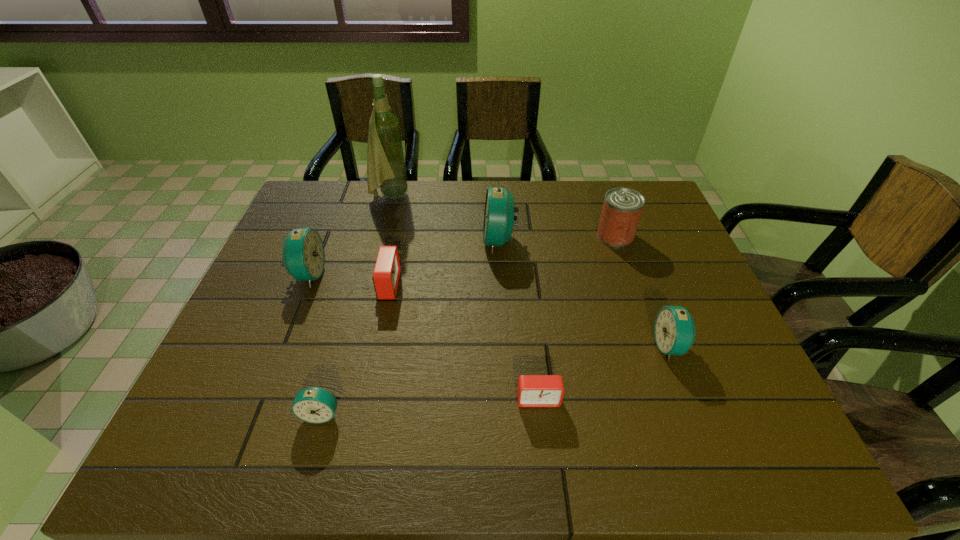
You are a GUI agent. You are given a task and a screenshot of the screen. Output one action in this format:
    pyautogui.click(x=<x>, y=<y>)
    Task: Click on the farthest object
    This screenshot has width=960, height=540.
    Given the screenshot: What is the action you would take?
    pyautogui.click(x=386, y=169)

Locate an element on the screen. wine bottle is located at coordinates (386, 169).

I want to click on the biggest blue alarm clock, so (x=498, y=216).

This screenshot has width=960, height=540. What are the coordinates of `the third blue alarm clock from left to right` in the screenshot? It's located at (498, 216).

You are a GUI agent. You are given a task and a screenshot of the screen. Output one action in this format:
    pyautogui.click(x=<x>, y=<y>)
    Task: Click on the second biggest blue alarm clock
    The width and height of the screenshot is (960, 540).
    Given the screenshot: What is the action you would take?
    pyautogui.click(x=303, y=253)

Find the location of a particular element. The height and width of the screenshot is (540, 960). the second tallest alarm clock is located at coordinates coord(303,253).

You are a GUI agent. You are given a task and a screenshot of the screen. Output one action in this format:
    pyautogui.click(x=<x>, y=<y>)
    Task: Click on the can
    The height and width of the screenshot is (540, 960).
    Given the screenshot: What is the action you would take?
    pyautogui.click(x=622, y=208)

Find the location of a particular element. This screenshot has height=540, width=960. the rightmost alarm clock is located at coordinates (674, 329).

Find the location of a particular element. The image size is (960, 540). the second smallest blue alarm clock is located at coordinates (674, 329).

Locate an element on the screen. the left red alarm clock is located at coordinates (386, 274).